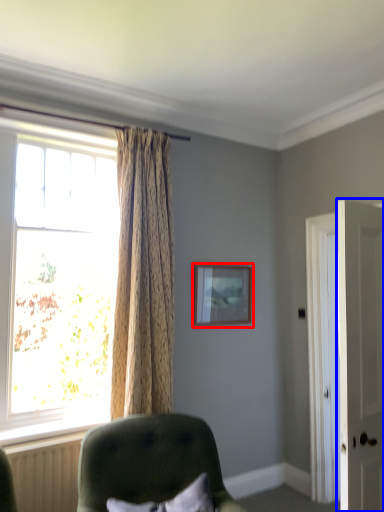
Question: Which of the following is the farthest to the observer, picture frame (highlighted by a red box) or door (highlighted by a blue box)?

Choices:
 (A) picture frame
 (B) door

Answer: (A)